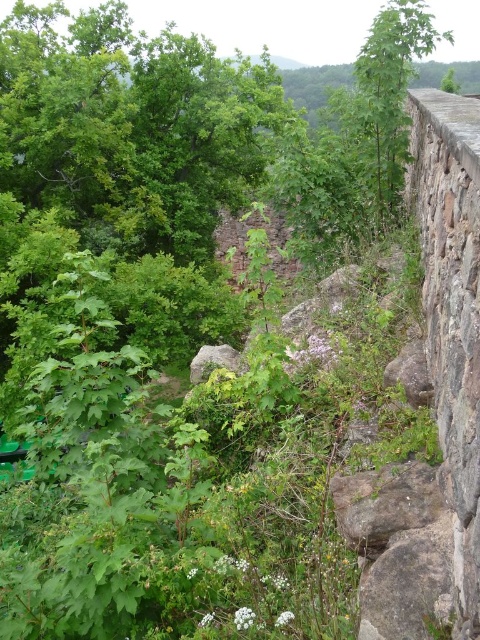
You are standing in the natural scene with the stone wall on your right. You notice two points marked in the image. The first point is at coordinates point (434,550) and the second is at point (383,467). From your perspective, which point is closer to you?

Point (434,550) is in front of point (383,467), so it is closer to you.

You are a gardener who wants to place a new plant pot that is 10 inches wide between the gray rough rock at lower right and the brown rough rock at center. Is there enough space between them to fit the pot?

The gray rough rock at lower right and brown rough rock at center are 8.53 inches apart from each other. Since the plant pot is 10 inches wide, there isn not enough space between them to fit the pot.

You are a gardener planning to plant a new flower bed between the green leafy tree at upper right and the brown rough rock at center. Considering their sizes, which object will require more space around it to avoid overcrowding?

The green leafy tree at upper right requires more space around it because it has a larger size compared to the brown rough rock at center.